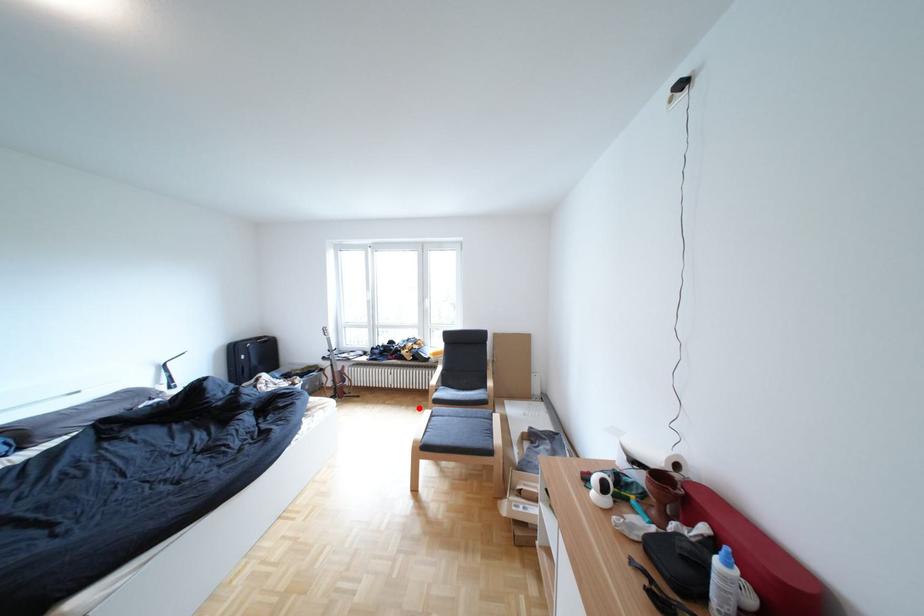
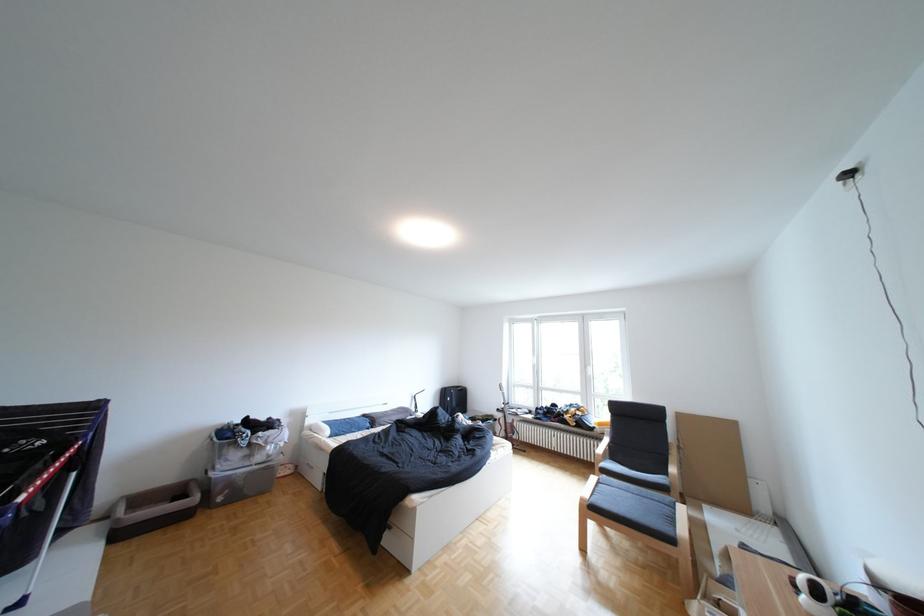
Where in the second image is the point corresponding to the highlighted location from the first image?

(584, 474)